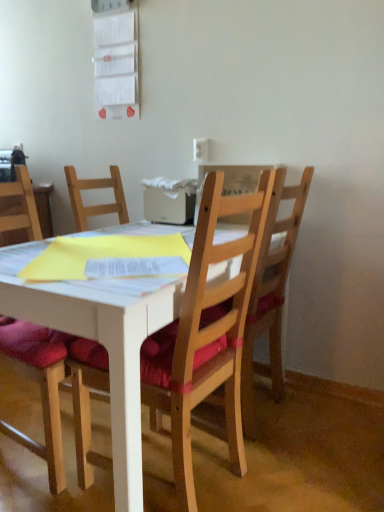
Identify the location of unoccupied region to the right of wooden chair at right, the 1th chair in the right-to-left sequence. (328, 416).